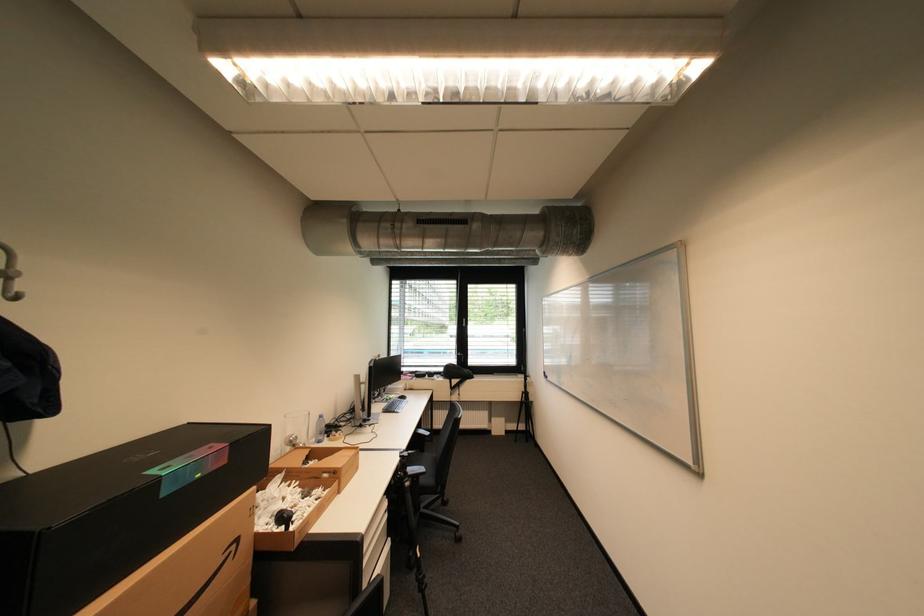
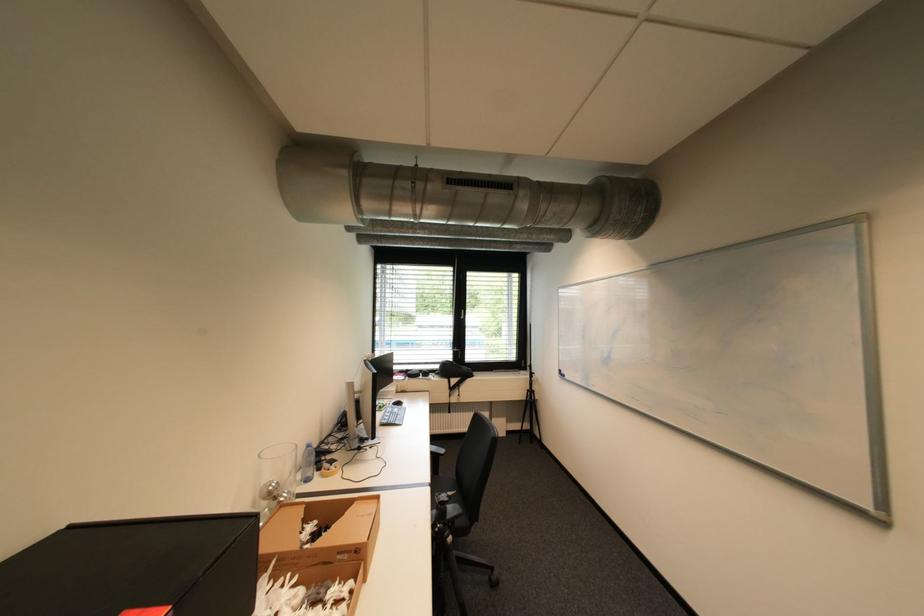
Find the pixel in the second image that matches pixel 399 397 in the first image.

(393, 403)